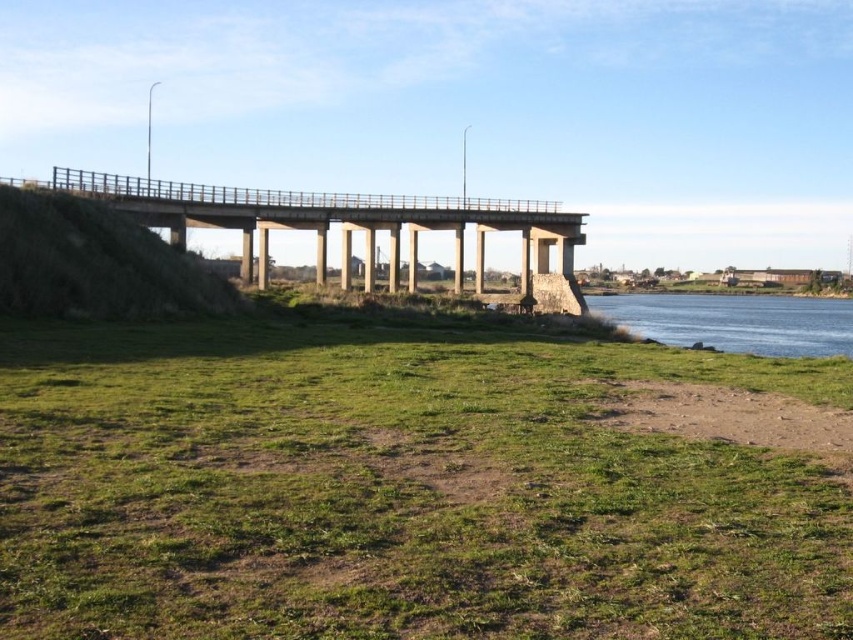
You are standing on the dirt ground at lower right and want to cross the water to the other side. Is the concrete bridge at center a suitable path? Explain why or why not based on their positions.

The concrete bridge at center is to the left of dirt ground at lower right, so it is positioned away from your current location. To reach the bridge, you would need to move leftward from the dirt ground at lower right. Once there, the bridge spans the water, making it a suitable path to cross to the other side.

You are a gardener who wants to plant flowers in the area shown. Which location would be better for planting, the green grassy at lower center or the dirt ground at lower right? Explain why based on the scene description.

The green grassy at lower center is better for planting flowers because it is much taller than the dirt ground at lower right, indicating healthier soil and more suitable conditions for growth.